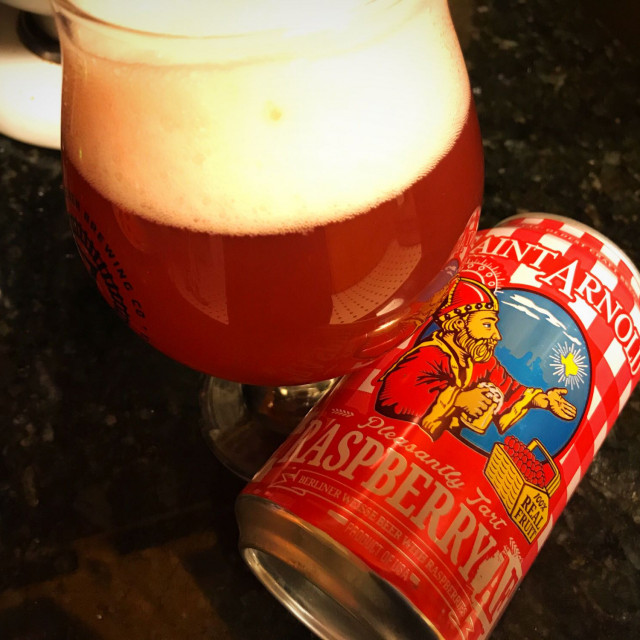
Find the location of a particular element. The height and width of the screenshot is (640, 640). beer stein is located at coordinates (486, 417).